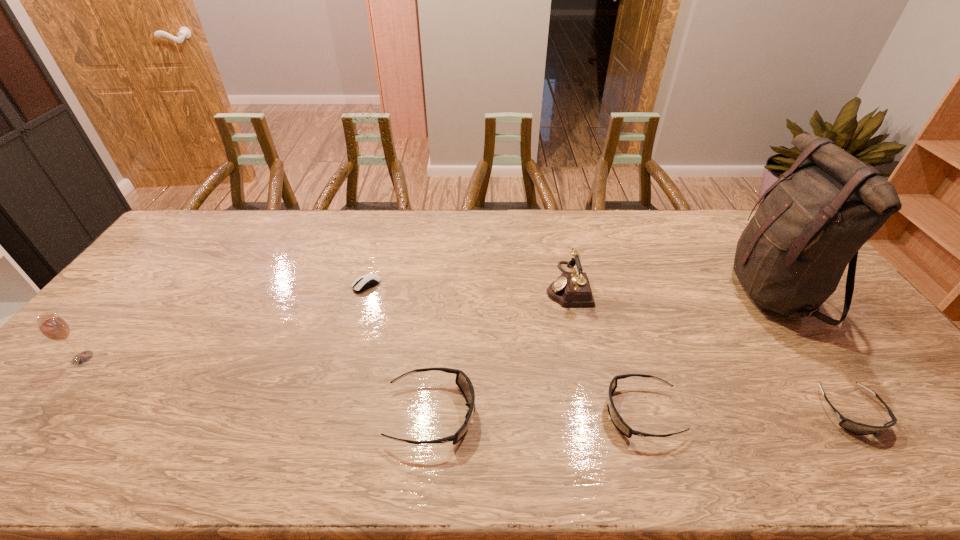
Locate an element on the screen. This screenshot has width=960, height=540. the fourth nearest object is located at coordinates (53, 327).

This screenshot has height=540, width=960. I want to click on the leftmost object, so click(53, 327).

Find the location of `vacant space located on the lenses of the fifth object from right to left`. vacant space located on the lenses of the fifth object from right to left is located at coordinates [614, 414].

Identify the location of free location located on the lenses of the second shortest goggles. (538, 413).

Where is `vacant space located on the lenses of the second shortest goggles`? The height and width of the screenshot is (540, 960). vacant space located on the lenses of the second shortest goggles is located at coordinates (475, 413).

The image size is (960, 540). Find the location of `vacant position located 0.220m on the lenses of the second shortest goggles`. vacant position located 0.220m on the lenses of the second shortest goggles is located at coordinates (513, 413).

Find the location of a particular element. Image resolution: width=960 pixels, height=540 pixels. blank area located 0.130m on the back of the mouse is located at coordinates (376, 251).

The height and width of the screenshot is (540, 960). What are the coordinates of `vacant area situated on the dial of the telephone` in the screenshot? It's located at (519, 285).

Find the location of a particular element. free space located on the dial of the telephone is located at coordinates (430, 285).

The width and height of the screenshot is (960, 540). I want to click on vacant space located on the dial of the telephone, so click(x=529, y=285).